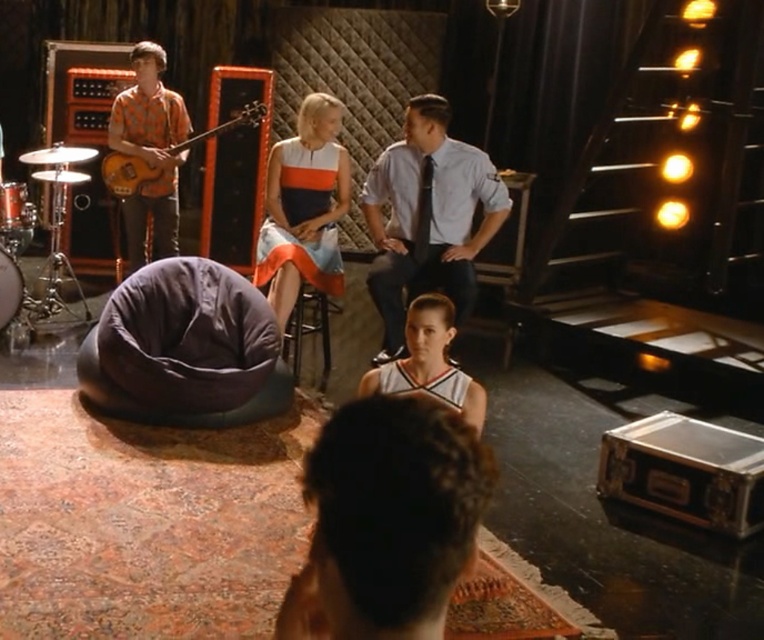
Measure the distance between dark gray silk tie at center and camera.

dark gray silk tie at center and camera are 4.47 meters apart from each other.

Where is `dark gray silk tie at center`? This screenshot has height=640, width=764. dark gray silk tie at center is located at coordinates 423,211.

Consider the image. Is orange wood guitar at upper left bigger than brushed metal drum at lower left?

Indeed, orange wood guitar at upper left has a larger size compared to brushed metal drum at lower left.

Between point (244, 113) and point (8, 289), which one is positioned in front?

Point (8, 289) is in front.

Which is in front, point (243, 108) or point (8, 308)?

Point (8, 308) is more forward.

I want to click on orange wood guitar at upper left, so [x=128, y=173].

Looking at this image, who is lower down, brown curly hair at center or brushed metal drum at lower left?

brown curly hair at center

Is point (455, 452) positioned behind point (2, 253)?

That is False.

Identify the location of brown curly hair at center. (387, 520).